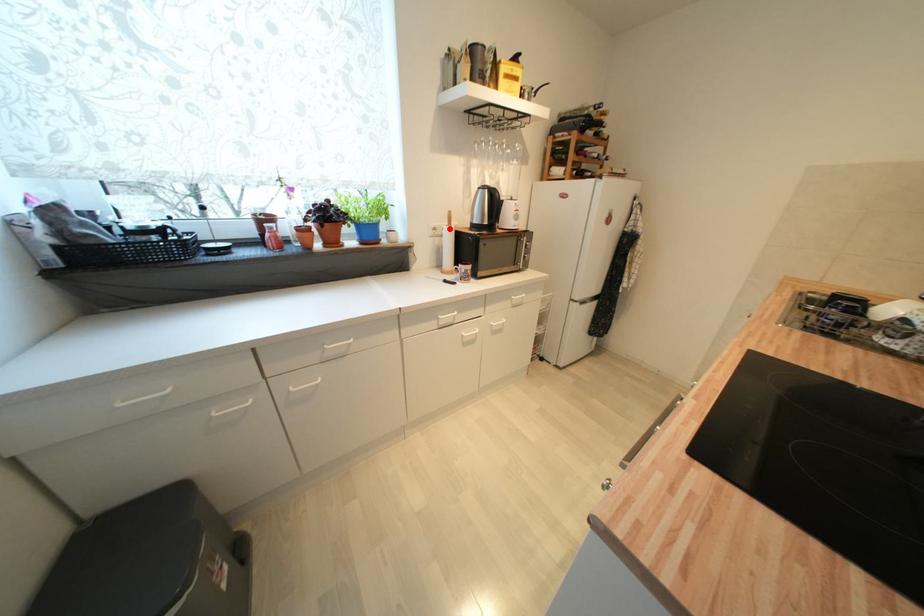
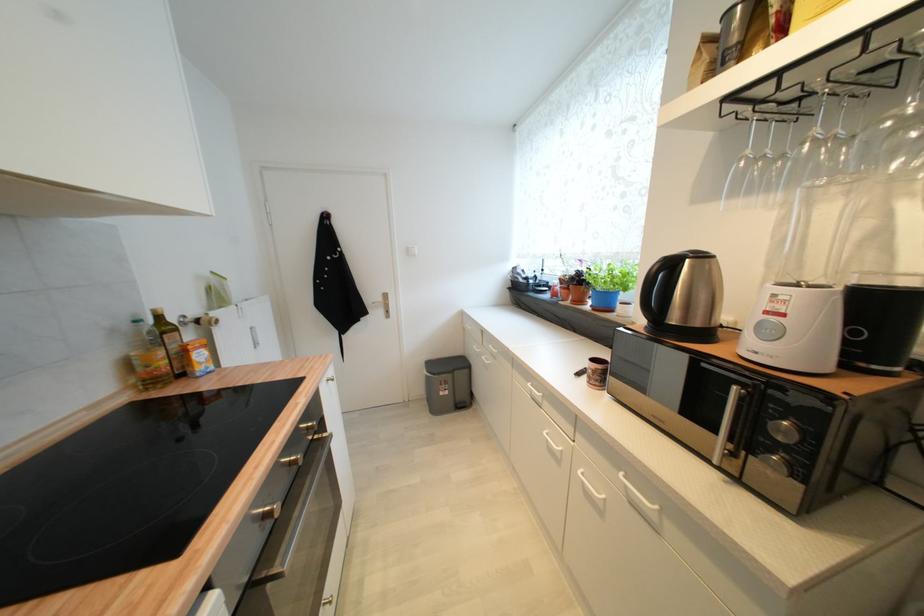
Question: I am providing you with two images of the same scene from different viewpoints. A red point is marked on the first image. Is the red point's position out of view in image 2?

Choices:
 (A) Yes
 (B) No

Answer: (A)